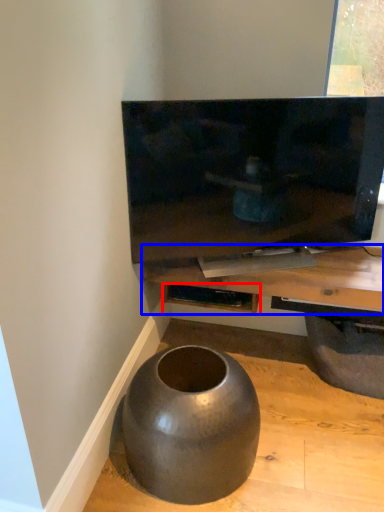
Question: Which point is closer to the camera, shelf (highlighted by a red box) or table (highlighted by a blue box)?

Choices:
 (A) shelf
 (B) table

Answer: (B)